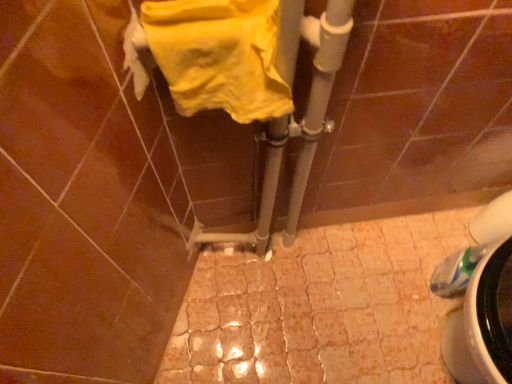
Describe the element at coordinates (219, 56) in the screenshot. I see `yellow fabric towel at upper center` at that location.

Where is `yellow fabric towel at upper center`? yellow fabric towel at upper center is located at coordinates (219, 56).

I want to click on yellow fabric towel at upper center, so click(219, 56).